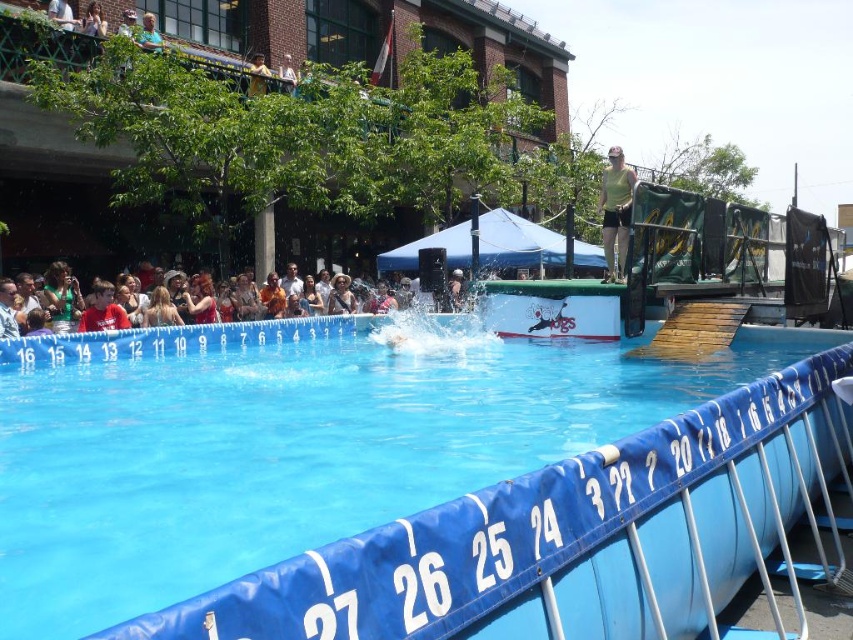
You are a photographer at the event and want to capture the blue rubber pool at center and the multicolored casual clothing at lower center in the same frame. Which object should you zoom in on to ensure both are visible without moving the camera?

You should zoom in on the multicolored casual clothing at lower center because the blue rubber pool at center is thinner, making it easier to include both in the frame by focusing on the wider object.

You are organizing a safety inspection for the event. The safety guidelines require that the pool must be at least twice as wide as any personal items placed in the center. Given the blue rubber pool at center and the leather jacket at center, can the leather jacket be safely placed in the center without violating the guidelines?

The blue rubber pool at center has a width less than the leather jacket at center. According to the guidelines, the pool must be at least twice as wide as the leather jacket. Since the pool is narrower than the jacket, placing the jacket in the center would violate the safety guidelines.

Consider the image. You are a photographer positioned at the camera. You want to capture a closeup shot of the matte brown hair at center. Given that your camera can focus on subjects within 10 meters, will you be able to take the closeup?

The matte brown hair at center is 18.56 meters from the camera, which is beyond the 10 meter focus range. You will not be able to take a closeup shot.